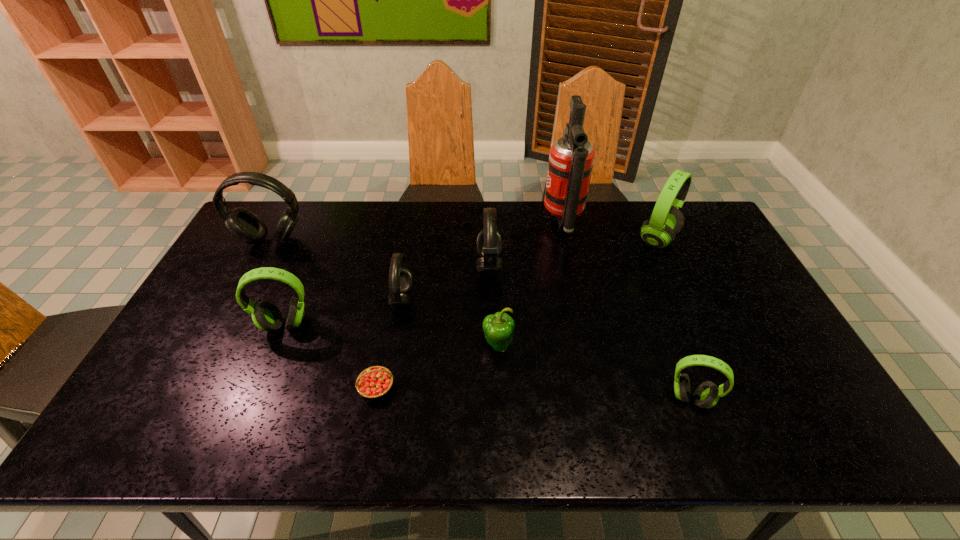
Identify the location of free spot located 0.140m on the earcups of the second smallest gray headset. (433, 267).

The height and width of the screenshot is (540, 960). Identify the location of vacant space located on the earcups of the second smallest gray headset. [373, 267].

The height and width of the screenshot is (540, 960). I want to click on vacant space located on the earcups of the second smallest gray headset, so click(x=355, y=267).

What are the coordinates of `blank area located on the right of the second biggest green headset` in the screenshot? It's located at (403, 325).

You are a GUI agent. You are given a task and a screenshot of the screen. Output one action in this format:
    pyautogui.click(x=<x>, y=<y>)
    Task: Click on the vacant region located 0.310m on the earcups of the third headset from left to right
    This screenshot has height=540, width=960.
    Given the screenshot: What is the action you would take?
    pyautogui.click(x=516, y=299)

The image size is (960, 540). Identify the location of vacant space located 0.210m on the back of the smallest green headset. (660, 320).

The height and width of the screenshot is (540, 960). Identify the location of vacant point located on the front of the bell pepper. (502, 447).

The image size is (960, 540). I want to click on vacant space located 0.230m on the right of the shortest object, so click(x=487, y=387).

The width and height of the screenshot is (960, 540). What are the coordinates of `fire extinguisher present at the far edge` in the screenshot? It's located at (571, 158).

This screenshot has height=540, width=960. In order to click on object situated at the left edge in this screenshot , I will do `click(243, 224)`.